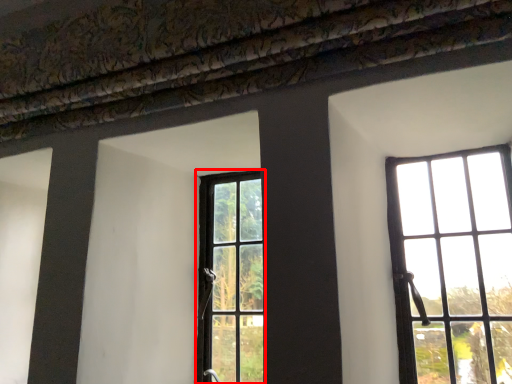
Question: Observing the image, what is the correct spatial positioning of window (annotated by the red box) in reference to window?

Choices:
 (A) left
 (B) right

Answer: (A)